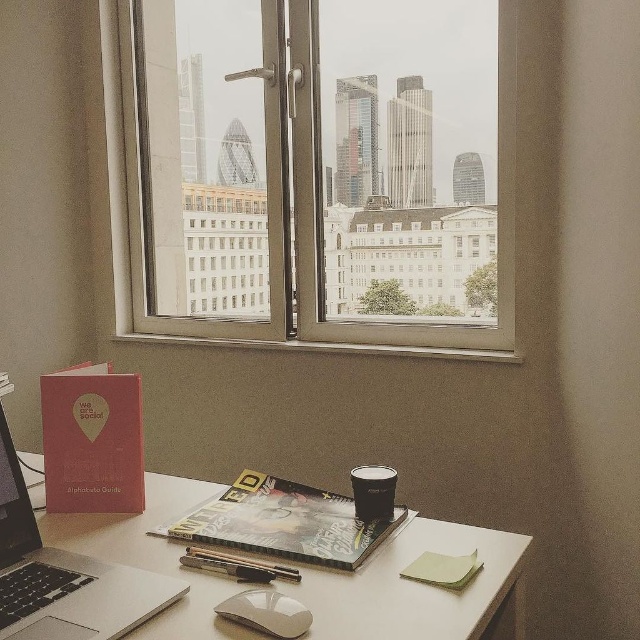
Question: Is black matte coffee cup at center thinner than metallic silver pen at center?

Choices:
 (A) yes
 (B) no

Answer: (A)

Question: Which object is the closest to the black matte coffee cup at center?

Choices:
 (A) silver metallic laptop at lower left
 (B) metallic silver pen at center
 (C) clear glass window at center
 (D) white glossy mouse at center

Answer: (B)

Question: Is white glossy mouse at center below metallic silver pen at center?

Choices:
 (A) no
 (B) yes

Answer: (B)

Question: Is matte pink book at lower left positioned in front of white glossy mouse at center?

Choices:
 (A) yes
 (B) no

Answer: (B)

Question: Among these objects, which one is farthest from the camera?

Choices:
 (A) white glossy table at lower center
 (B) matte hardcover book at center
 (C) white glossy mouse at center
 (D) silver metallic laptop at lower left

Answer: (B)

Question: Which object is closer to the camera taking this photo?

Choices:
 (A) silver metallic laptop at lower left
 (B) white glossy table at lower center

Answer: (A)